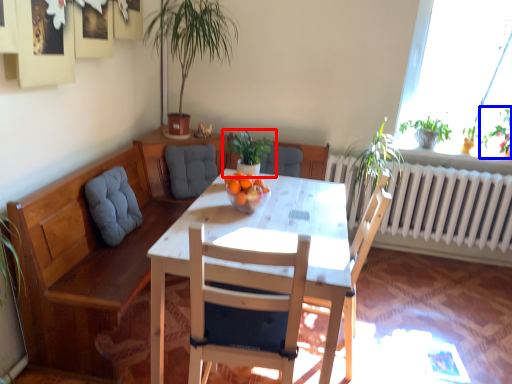
Question: Which point is closer to the camera, houseplant (highlighted by a red box) or plant (highlighted by a blue box)?

Choices:
 (A) houseplant
 (B) plant

Answer: (A)